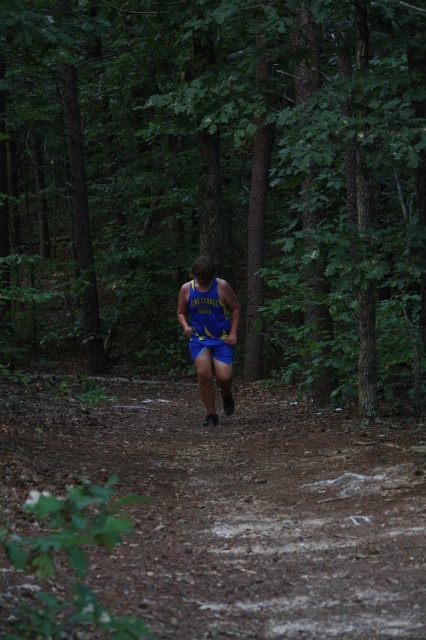
Is green matte forest at center below brown dirt track at center?

Incorrect, green matte forest at center is not positioned below brown dirt track at center.

Which is below, green matte forest at center or brown dirt track at center?

brown dirt track at center

Find the location of a particular element. Image resolution: width=426 pixels, height=640 pixels. green matte forest at center is located at coordinates (218, 180).

Measure the distance from blue fabric shorts at center to yellow jersey at center.

4.02 inches

Can you confirm if blue fabric shorts at center is bigger than yellow jersey at center?

Yes, blue fabric shorts at center is bigger than yellow jersey at center.

Locate an element on the screen. This screenshot has width=426, height=640. blue fabric shorts at center is located at coordinates (210, 332).

Can you confirm if brown dirt track at center is thinner than yellow jersey at center?

No.

Does brown dirt track at center lie behind yellow jersey at center?

No.

The height and width of the screenshot is (640, 426). What do you see at coordinates (236, 508) in the screenshot?
I see `brown dirt track at center` at bounding box center [236, 508].

Find the location of `brown dirt track at center`. brown dirt track at center is located at coordinates (236, 508).